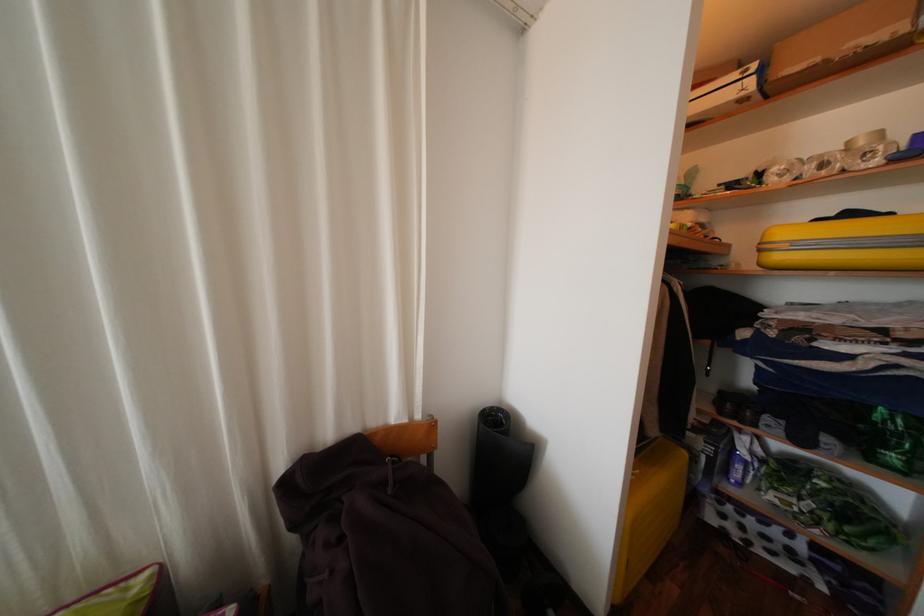
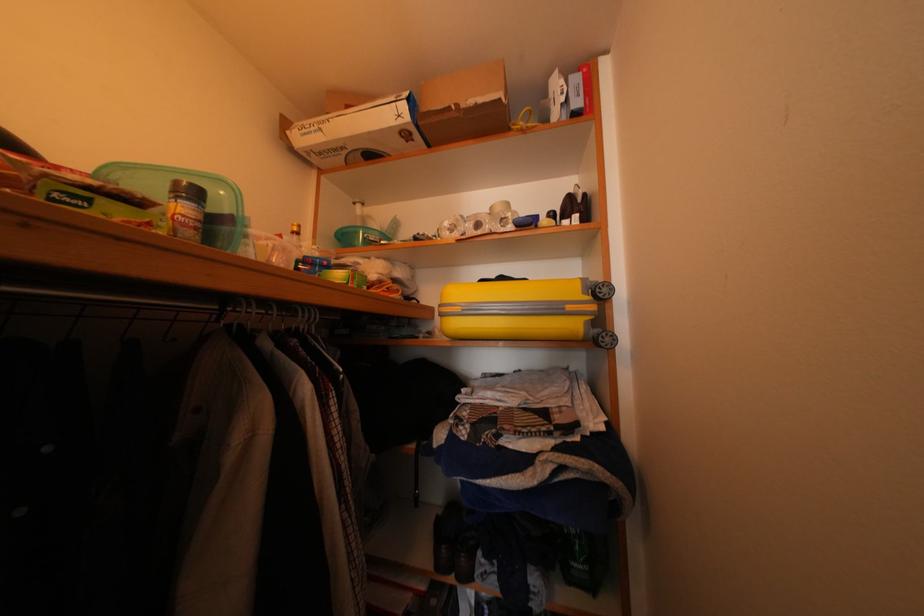
Question: Based on the continuous images, in which direction is the camera rotating? Reply with the corresponding letter.

Choices:
 (A) Left
 (B) Right
 (C) Up
 (D) Down

Answer: (B)